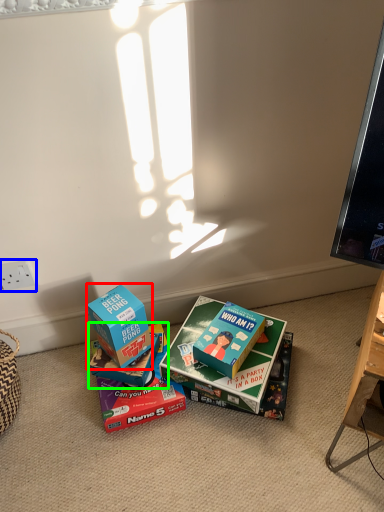
Question: Which is farther away from box (highlighted by a red box)? power outlet (highlighted by a blue box) or box (highlighted by a green box)?

Choices:
 (A) power outlet
 (B) box

Answer: (A)